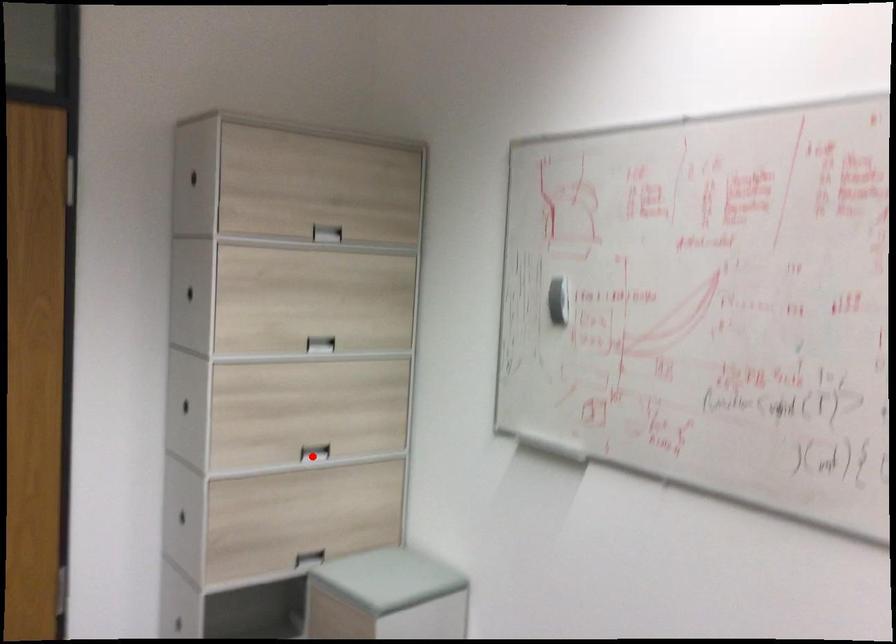
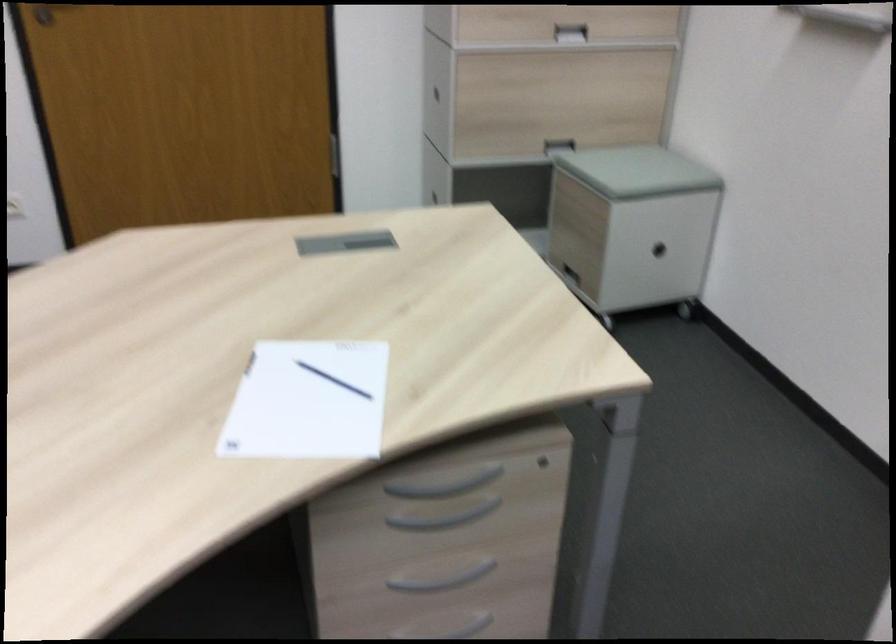
Where in the second image is the point corresponding to the highlighted location from the first image?

(570, 33)